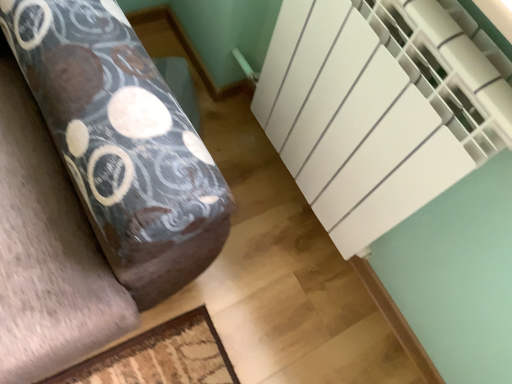
Question: From their relative heights in the image, would you say white matte radiator at right is taller or shorter than white matte radiator at upper right?

Choices:
 (A) tall
 (B) short

Answer: (A)

Question: In the image, is white matte radiator at right on the left side or the right side of white matte radiator at upper right?

Choices:
 (A) left
 (B) right

Answer: (B)

Question: From the image's perspective, relative to white matte radiator at upper right, is white matte radiator at right above or below?

Choices:
 (A) below
 (B) above

Answer: (B)

Question: Relative to white matte radiator at right, is white matte radiator at upper right in front or behind?

Choices:
 (A) behind
 (B) front

Answer: (A)

Question: From a real-world perspective, is white matte radiator at upper right above or below white matte radiator at right?

Choices:
 (A) above
 (B) below

Answer: (B)

Question: Is white matte radiator at upper right wider or thinner than white matte radiator at right?

Choices:
 (A) thin
 (B) wide

Answer: (B)

Question: From the image's perspective, relative to white matte radiator at right, is white matte radiator at upper right above or below?

Choices:
 (A) above
 (B) below

Answer: (B)